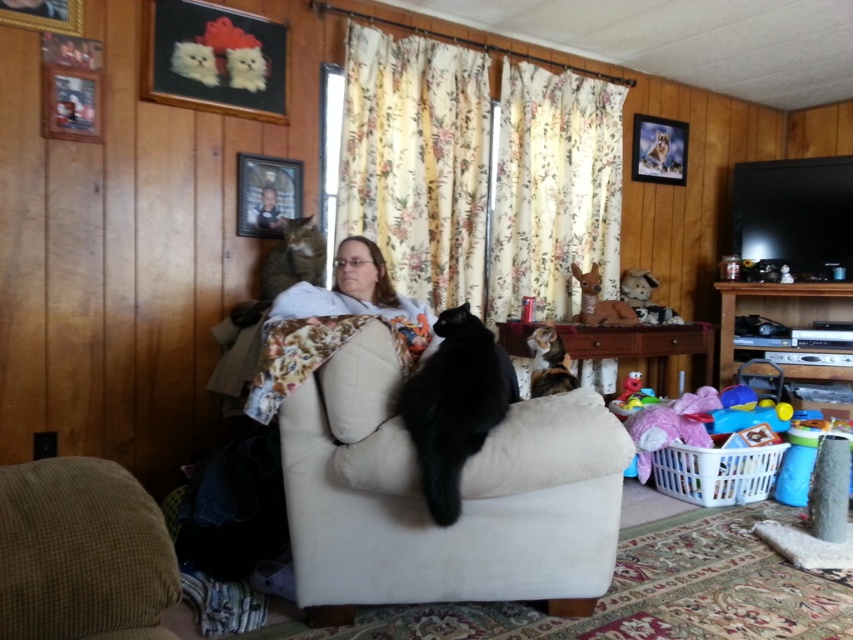
Question: Where is floral fabric curtain at center located in relation to tabby fur cat at left in the image?

Choices:
 (A) left
 (B) right

Answer: (B)

Question: Is calico fur cat at center positioned in front of smooth skin portrait at upper center?

Choices:
 (A) yes
 (B) no

Answer: (A)

Question: Among these points, which one is farthest from the camera?

Choices:
 (A) (602, 161)
 (B) (308, 412)
 (C) (299, 252)

Answer: (A)

Question: Among these objects, which one is farthest from the camera?

Choices:
 (A) floral fabric curtain at center
 (B) smooth skin portrait at upper center
 (C) black fur cat at center
 (D) calico fur cat at center

Answer: (A)

Question: Is white plastic laundry basket at lower right below smooth skin portrait at upper center?

Choices:
 (A) no
 (B) yes

Answer: (B)

Question: Which point is farther to the camera?

Choices:
 (A) (434, 390)
 (B) (743, 483)

Answer: (B)